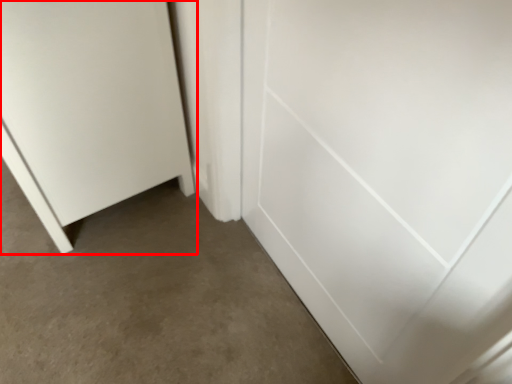
Question: From the image's perspective, what is the correct spatial positioning of door (annotated by the red box) in reference to door?

Choices:
 (A) below
 (B) above

Answer: (B)